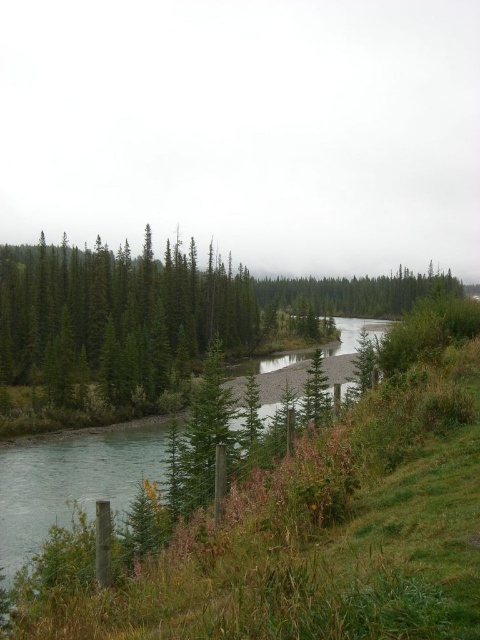
What do you see at coordinates (70, 480) in the screenshot? The height and width of the screenshot is (640, 480). I see `green smooth river at center` at bounding box center [70, 480].

Which is more to the left, green smooth river at center or green matte trees at center?

green smooth river at center is more to the left.

Is point (120, 481) behind point (267, 291)?

That is False.

Where is `green smooth river at center`? Image resolution: width=480 pixels, height=640 pixels. green smooth river at center is located at coordinates (70, 480).

Is point (183, 275) in front of point (309, 294)?

Yes.

Where is `green matte tree at center-left`? The width and height of the screenshot is (480, 640). green matte tree at center-left is located at coordinates (118, 316).

At what (x,y) coordinates should I click in order to perform the action: click on green matte tree at center-left. Please return your answer as a coordinate pair (x, y). This screenshot has width=480, height=640. Looking at the image, I should click on (118, 316).

Is point (159, 339) positioned behind point (34, 531)?

Yes, point (159, 339) is behind point (34, 531).

Is point (157, 385) closer to camera compared to point (27, 474)?

No, it is behind (27, 474).

In order to click on green matte tree at center-left in this screenshot , I will do 118,316.